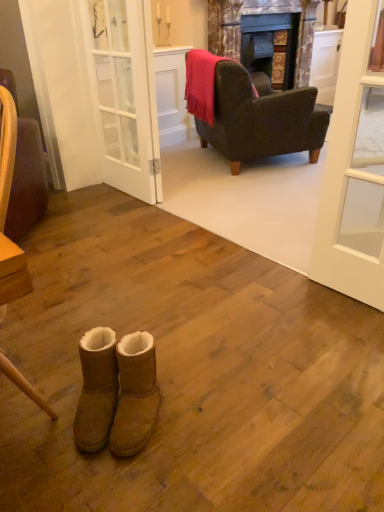
Question: In the image, is brown suede boots at lower center, which is counted as the second footwear, starting from the right, positioned in front of or behind velvet purple chair at left, marked as the second chair in a back-to-front arrangement?

Choices:
 (A) front
 (B) behind

Answer: (A)

Question: In terms of width, does brown suede boots at lower center, placed as the first footwear when sorted from left to right, look wider or thinner when compared to velvet purple chair at left, marked as the second chair in a back-to-front arrangement?

Choices:
 (A) thin
 (B) wide

Answer: (A)

Question: Which is farther from the velvet pink throw at upper center?

Choices:
 (A) marble fireplace at center
 (B) tan suede boots at lower center, the first footwear viewed from the right
 (C) brown suede boots at lower center, placed as the first footwear when sorted from left to right
 (D) velvet purple chair at left, arranged as the first chair when viewed from the front
 (E) white glass door at upper right

Answer: (C)

Question: Estimate the real-world distances between objects in this image. Which object is closer to the dark brown leather armchair at upper right, which is the first chair in right-to-left order?

Choices:
 (A) tan suede boots at lower center, the 2th footwear viewed from the left
 (B) white glass door at upper right
 (C) velvet purple chair at left, arranged as the first chair when viewed from the front
 (D) marble fireplace at center
 (E) white glass door at center

Answer: (E)